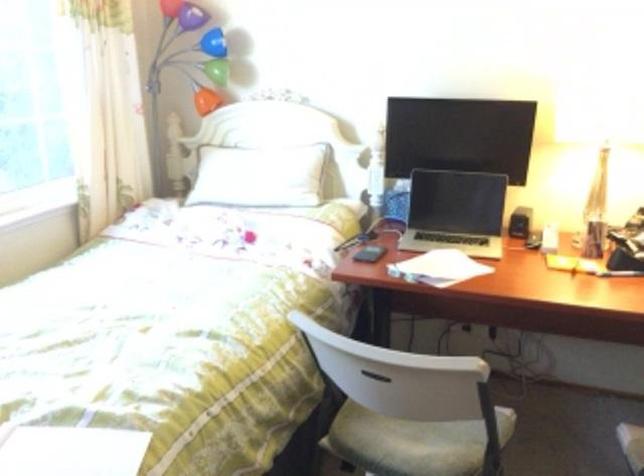
Where would you lift the soda bottle? Please return your answer as a coordinate pair (x, y).

(596, 207)